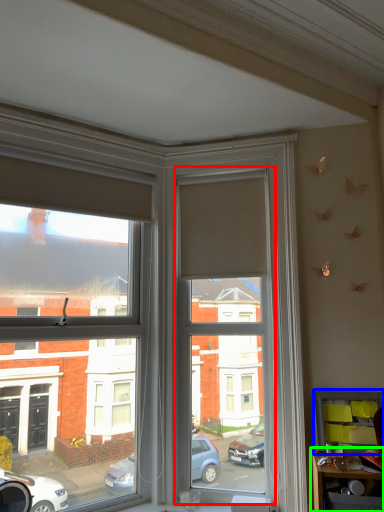
Question: Based on their relative distances, which object is nearer to window screen (highlighted by a red box)? Choose from shelf (highlighted by a blue box) and table (highlighted by a green box).

Choices:
 (A) shelf
 (B) table

Answer: (A)